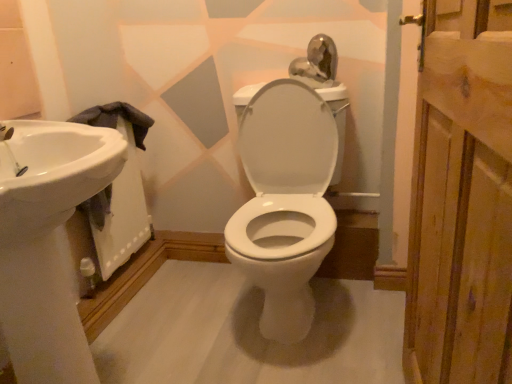
Question: Can you confirm if wooden plank at right is thinner than white glossy sink at left?

Choices:
 (A) no
 (B) yes

Answer: (B)

Question: Does wooden plank at right come in front of white glossy sink at left?

Choices:
 (A) no
 (B) yes

Answer: (B)

Question: From the image's perspective, is wooden plank at right on top of white glossy sink at left?

Choices:
 (A) no
 (B) yes

Answer: (B)

Question: Can you confirm if wooden plank at right is positioned to the left of white glossy sink at left?

Choices:
 (A) yes
 (B) no

Answer: (B)

Question: Is wooden plank at right facing away from white glossy sink at left?

Choices:
 (A) yes
 (B) no

Answer: (B)

Question: Looking at the image, does white glossy sink at left seem bigger or smaller compared to wooden plank at right?

Choices:
 (A) small
 (B) big

Answer: (B)

Question: Would you say white glossy sink at left is inside or outside wooden plank at right?

Choices:
 (A) outside
 (B) inside

Answer: (A)

Question: Looking at their shapes, would you say white glossy sink at left is wider or thinner than wooden plank at right?

Choices:
 (A) thin
 (B) wide

Answer: (B)

Question: Considering their positions, is white glossy sink at left located in front of or behind wooden plank at right?

Choices:
 (A) front
 (B) behind

Answer: (B)

Question: Is wooden plank at right inside the boundaries of white glossy sink at left, or outside?

Choices:
 (A) inside
 (B) outside

Answer: (B)

Question: Looking at their shapes, would you say wooden plank at right is wider or thinner than white glossy sink at left?

Choices:
 (A) thin
 (B) wide

Answer: (A)

Question: From a real-world perspective, is wooden plank at right above or below white glossy sink at left?

Choices:
 (A) above
 (B) below

Answer: (A)

Question: Is wooden plank at right in front of or behind white glossy sink at left in the image?

Choices:
 (A) front
 (B) behind

Answer: (A)

Question: Do you think white glossy sink at left is within wooden plank at right, or outside of it?

Choices:
 (A) outside
 (B) inside

Answer: (A)

Question: Looking at the image, does white glossy sink at left seem bigger or smaller compared to wooden plank at right?

Choices:
 (A) big
 (B) small

Answer: (B)